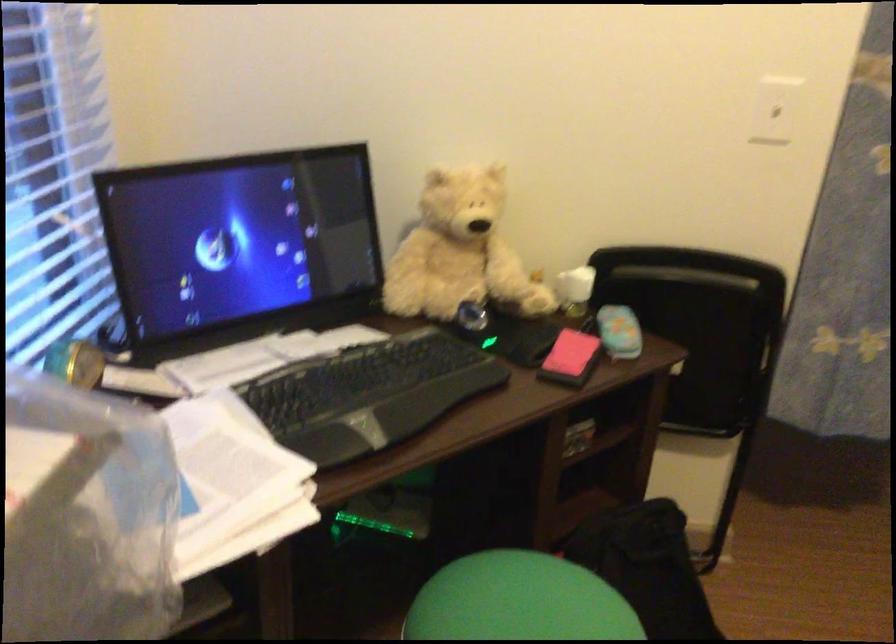
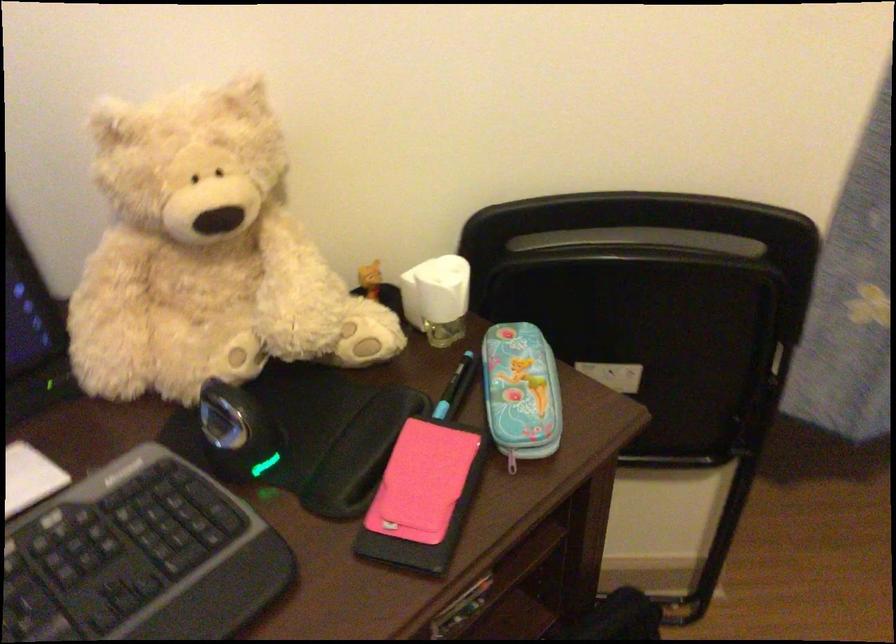
In the second image, find the point that corresponds to [459,242] in the first image.

(205, 254)